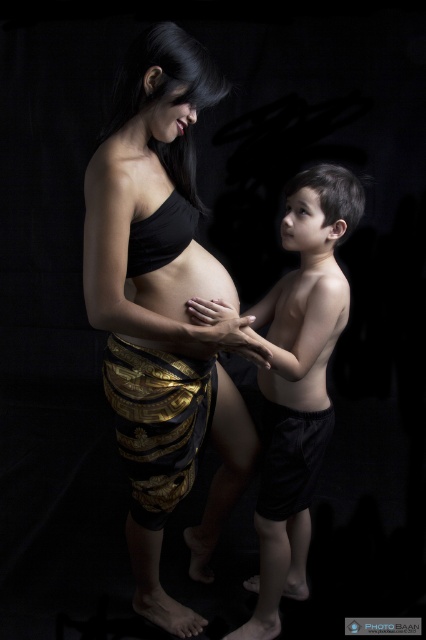
Is matte skin at center positioned in front of smooth skin hand at center?

That is False.

Is matte skin at center smaller than smooth skin hand at center?

No, matte skin at center is not smaller than smooth skin hand at center.

Who is more forward, [198,257] or [226,316]?

Point [226,316]

Identify the location of matte skin at center. The height and width of the screenshot is (640, 426). (184, 284).

Is black matte fabric at center closer to the viewer compared to smooth skin hand at center?

Result: Yes.

Who is positioned more to the left, black matte fabric at center or smooth skin hand at center?

black matte fabric at center

Is point (146, 289) more distant than point (264, 305)?

No, (146, 289) is in front of (264, 305).

Where is `black matte fabric at center`? The width and height of the screenshot is (426, 640). black matte fabric at center is located at coordinates (163, 310).

Who is more forward, (86, 236) or (175, 288)?

Point (86, 236) is in front.

Consider the image. Who is positioned more to the right, black matte fabric at center or matte skin at center?

matte skin at center is more to the right.

Find the location of a particular element. black matte fabric at center is located at coordinates (163, 310).